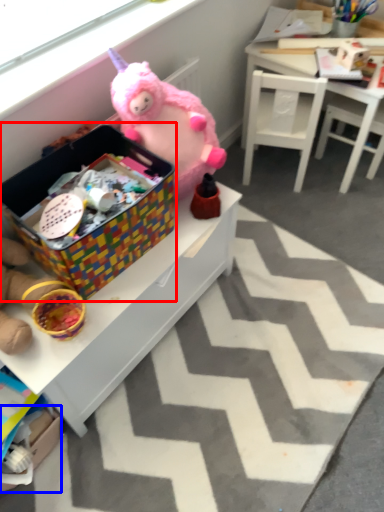
Question: Among these objects, which one is farthest to the camera, storage box (highlighted by a red box) or cardboard box (highlighted by a blue box)?

Choices:
 (A) storage box
 (B) cardboard box

Answer: (B)